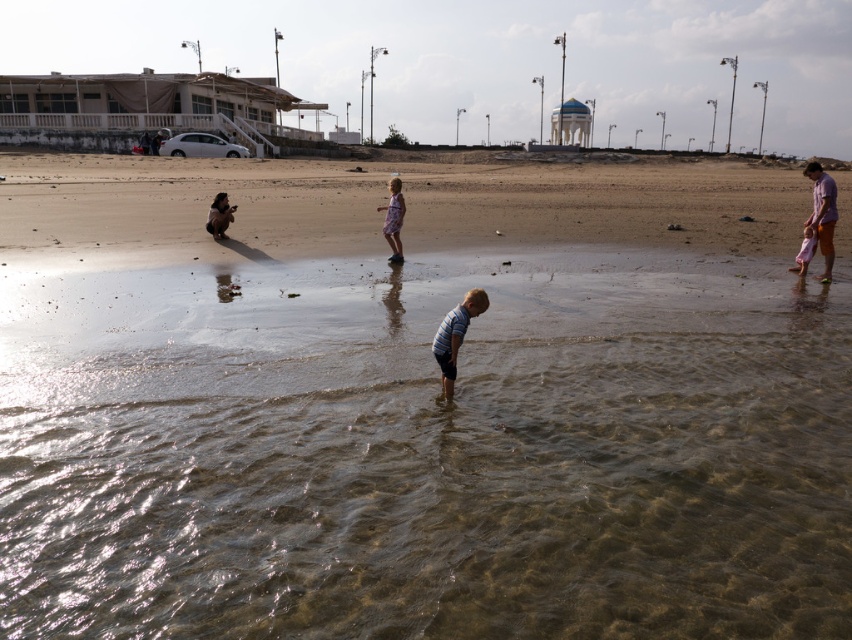
Question: Can you confirm if floral dress at center is bigger than brown fur dog at center?

Choices:
 (A) yes
 (B) no

Answer: (B)

Question: Is brown sandy beach at center wider than floral dress at center?

Choices:
 (A) yes
 (B) no

Answer: (A)

Question: Can you confirm if striped cotton shirt at center is smaller than orange cotton shorts at right?

Choices:
 (A) no
 (B) yes

Answer: (B)

Question: Among these objects, which one is nearest to the camera?

Choices:
 (A) orange cotton shorts at right
 (B) floral dress at center
 (C) brown sandy beach at center
 (D) clear water at lower center

Answer: (D)

Question: Among these points, which one is farthest from the camera?

Choices:
 (A) (496, 456)
 (B) (413, 164)

Answer: (B)

Question: Which object is positioned closest to the clear water at lower center?

Choices:
 (A) floral dress at center
 (B) orange cotton shorts at right

Answer: (A)